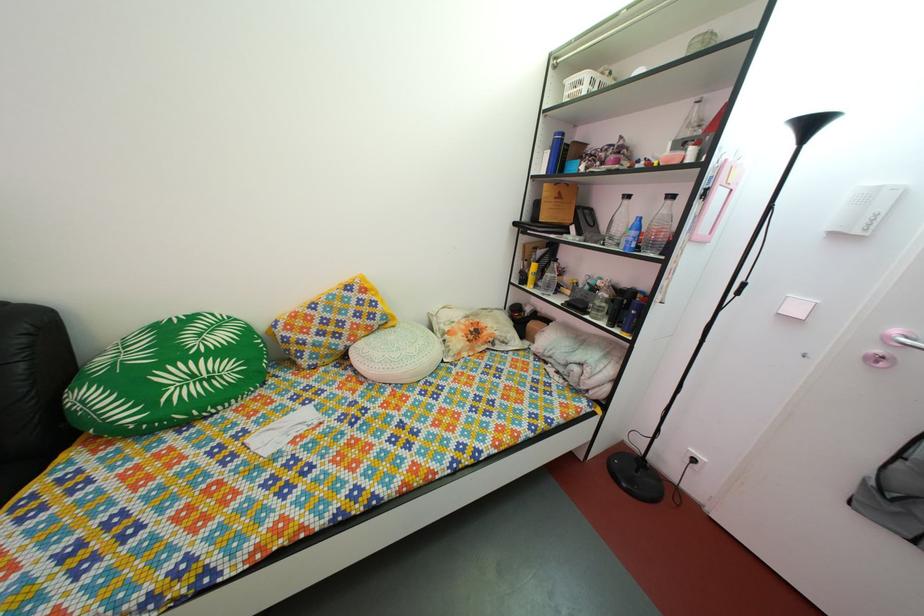
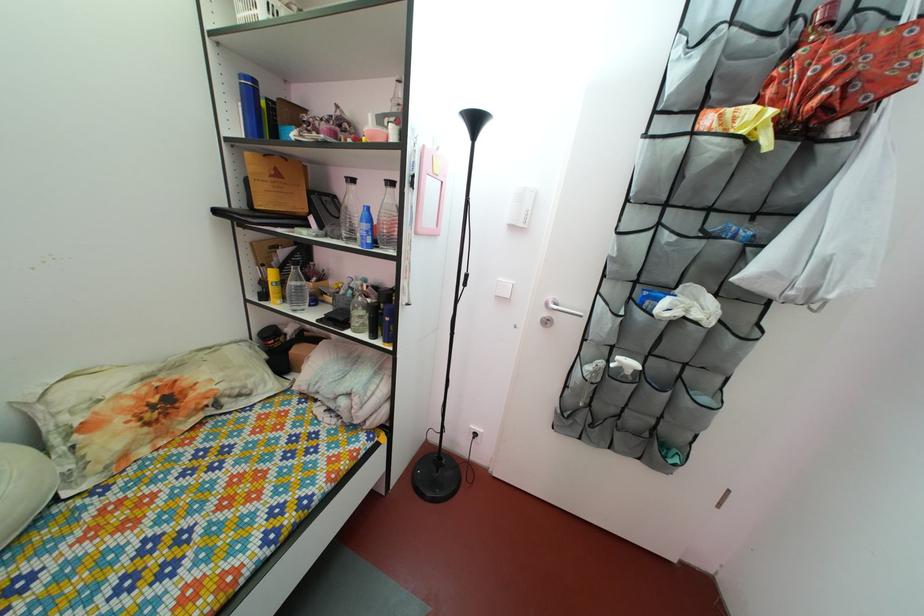
Locate, in the second image, the point that corresponds to (652,238) in the first image.

(383, 230)